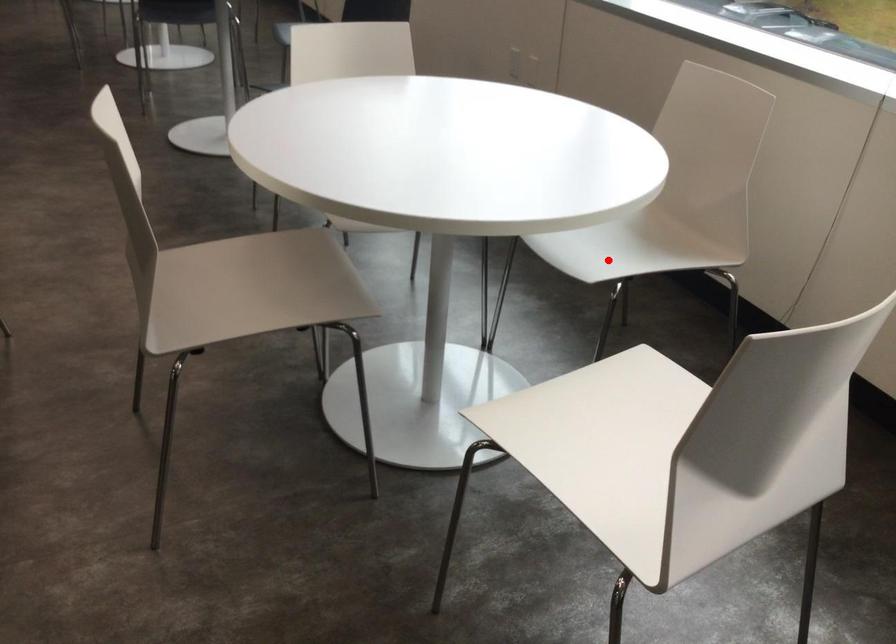
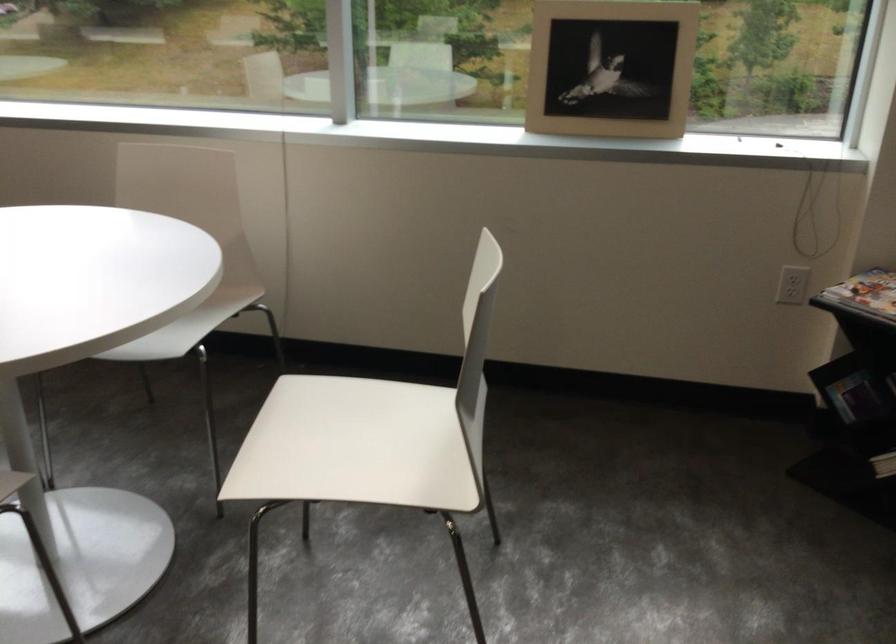
Locate, in the second image, the point that corresponds to the highlighted location in the first image.

(186, 327)